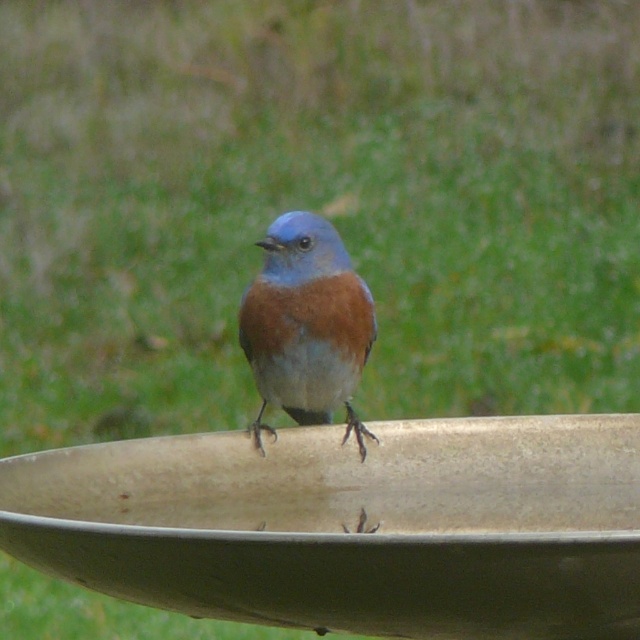
Question: Which point is farther to the camera?

Choices:
 (A) (288, 305)
 (B) (292, 598)

Answer: (A)

Question: Is the position of beige ceramic bird bath at center more distant than that of blue glossy bird at center?

Choices:
 (A) yes
 (B) no

Answer: (B)

Question: Is beige ceramic bird bath at center to the right of blue glossy bird at center from the viewer's perspective?

Choices:
 (A) no
 (B) yes

Answer: (B)

Question: Does beige ceramic bird bath at center appear on the left side of blue glossy bird at center?

Choices:
 (A) yes
 (B) no

Answer: (B)